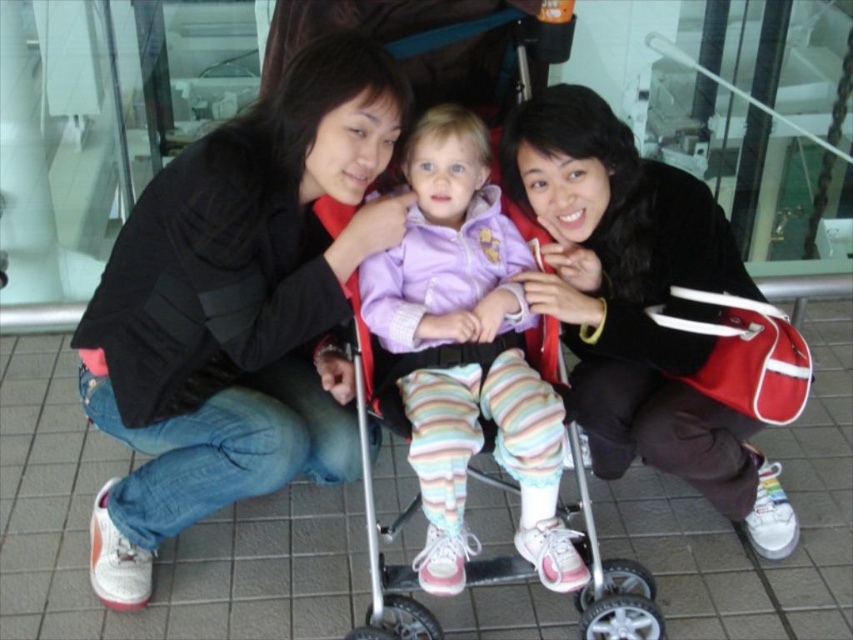
Question: Which of the following is the closest to the observer?

Choices:
 (A) (262, 308)
 (B) (724, 252)
 (C) (544, 496)

Answer: (C)

Question: Which point is farther to the camera?

Choices:
 (A) black soft jacket at center
 (B) pastel striped leggings at center
 (C) matte black jacket at center

Answer: (A)

Question: Is matte black jacket at center wider than pastel striped leggings at center?

Choices:
 (A) yes
 (B) no

Answer: (A)

Question: Is matte black jacket at center above pastel striped leggings at center?

Choices:
 (A) yes
 (B) no

Answer: (A)

Question: Is black soft jacket at center below pastel striped leggings at center?

Choices:
 (A) no
 (B) yes

Answer: (A)

Question: Which is farther from the black soft jacket at center?

Choices:
 (A) pastel striped leggings at center
 (B) matte black jacket at center

Answer: (B)